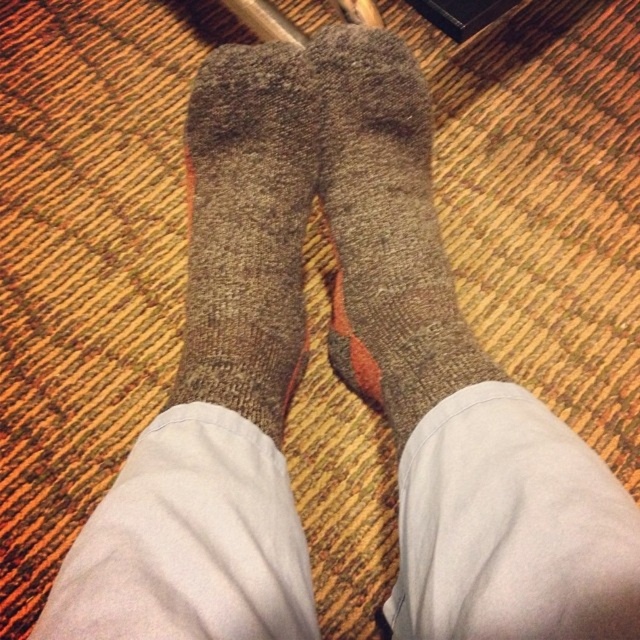
Can you confirm if woolen socks at center is positioned below gray woolen sock at center?

Actually, woolen socks at center is above gray woolen sock at center.

The height and width of the screenshot is (640, 640). Describe the element at coordinates (385, 230) in the screenshot. I see `woolen socks at center` at that location.

This screenshot has width=640, height=640. Identify the location of woolen socks at center. (385, 230).